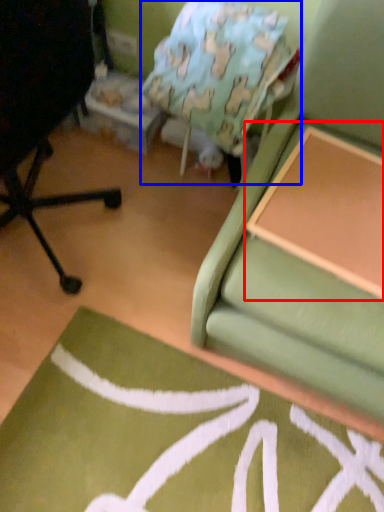
Question: Which object appears farthest to the camera in this image, table (highlighted by a red box) or bean bag chair (highlighted by a blue box)?

Choices:
 (A) table
 (B) bean bag chair

Answer: (B)